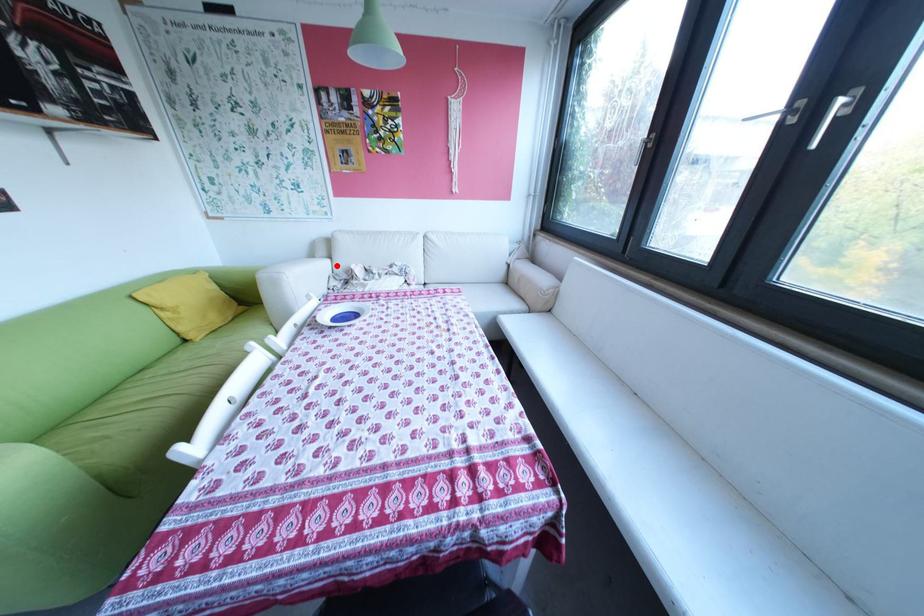
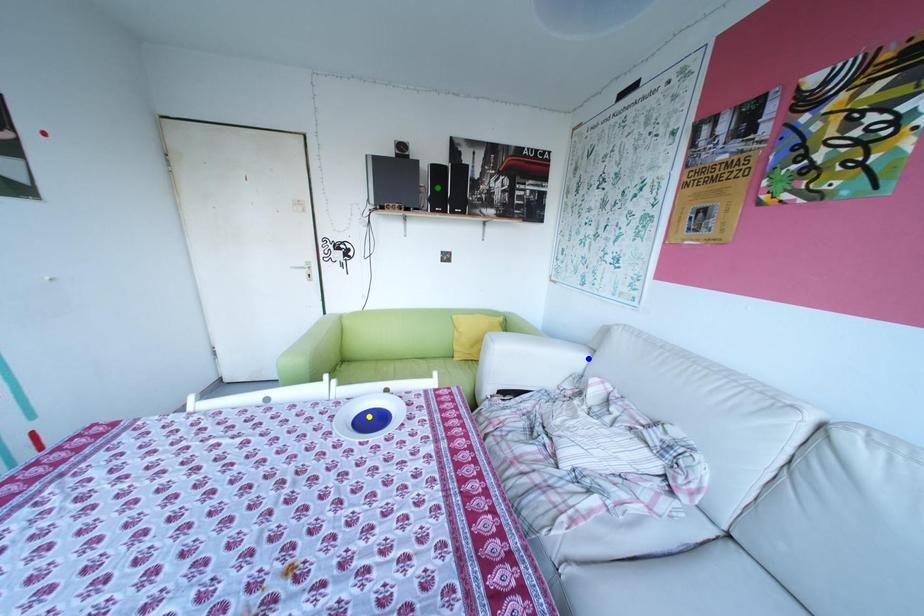
Question: I am providing you with two images of the same scene from different viewpoints. A red point is marked on the first image. You are given multiple points on the second image. Which mark in image 2 goes with the point in image 1?

Choices:
 (A) blue point
 (B) yellow point
 (C) green point

Answer: (A)